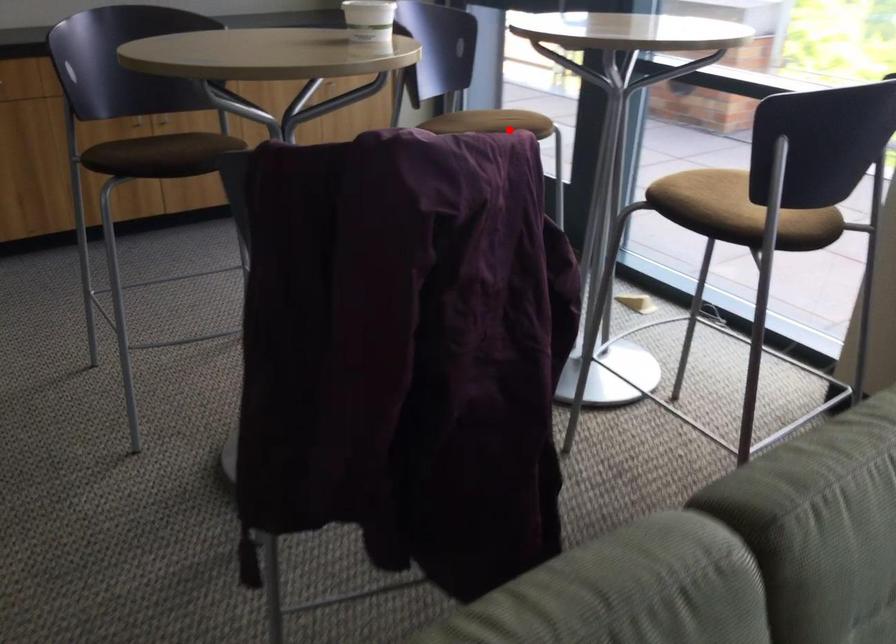
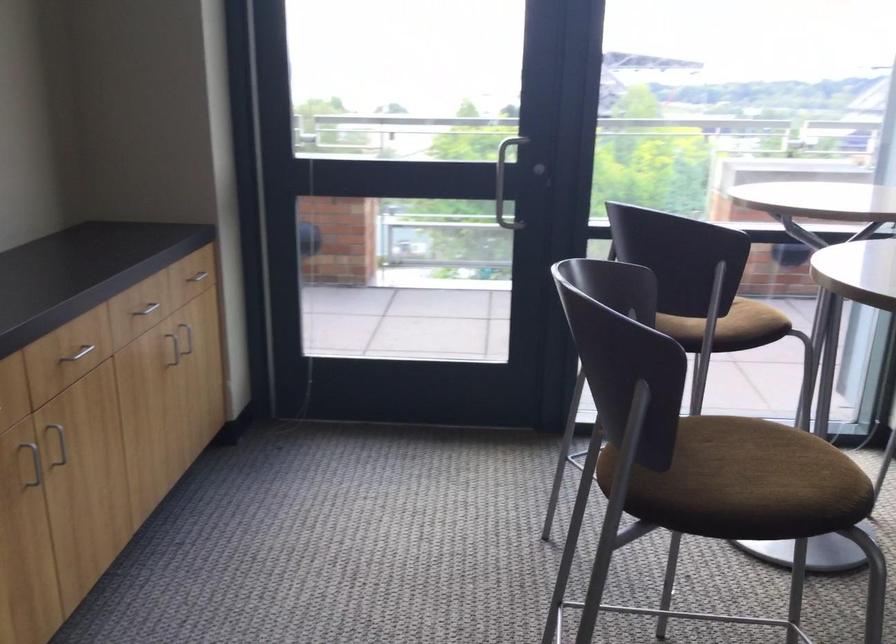
Question: I am providing you with two images of the same scene from different viewpoints. A red point is shown in image1. For the corresponding object point in image2, is it positioned nearer or farther from the camera?

Choices:
 (A) Nearer
 (B) Farther

Answer: (A)